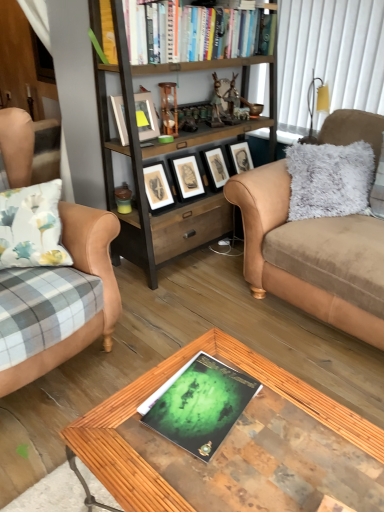
The height and width of the screenshot is (512, 384). Identify the location of vacant space in front of woodenmaterial/texture bookcase at center. (206, 303).